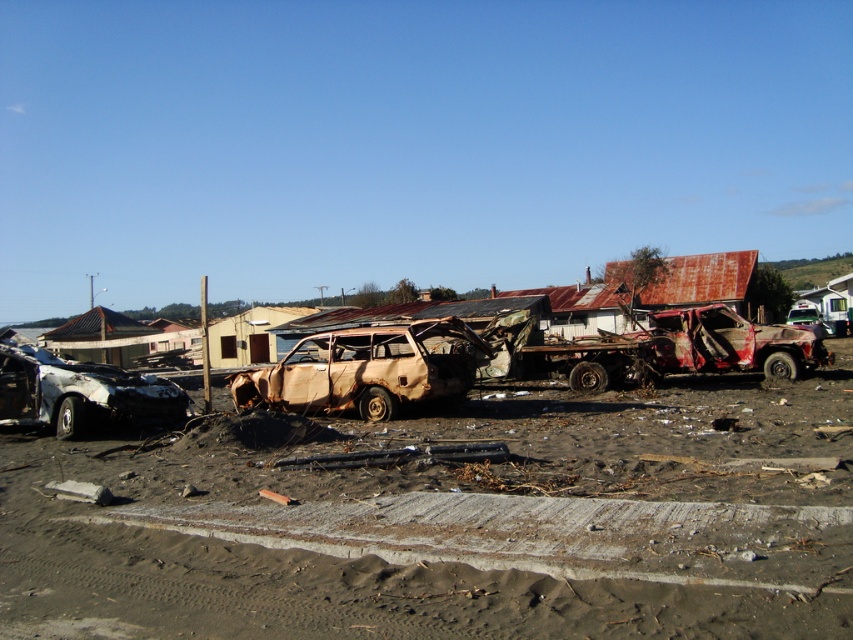
Is burnt wood car at center to the left of burnt wood car at lower left from the viewer's perspective?

No, burnt wood car at center is not to the left of burnt wood car at lower left.

This screenshot has width=853, height=640. What do you see at coordinates (368, 369) in the screenshot?
I see `burnt wood car at center` at bounding box center [368, 369].

Is point (331, 404) less distant than point (140, 381)?

No, (331, 404) is further to viewer.

Find the location of a particular element. This screenshot has width=853, height=640. burnt wood car at center is located at coordinates (368, 369).

Does burnt wood car at lower left appear under rusty metal truck at center-right?

Correct, burnt wood car at lower left is located below rusty metal truck at center-right.

Does point (149, 406) lie in front of point (764, 369)?

Yes, point (149, 406) is in front of point (764, 369).

This screenshot has width=853, height=640. Identify the location of burnt wood car at lower left. (80, 392).

Can you confirm if rusty metal truck at center-right is positioned to the right of rusty metal truck at right?

Incorrect, rusty metal truck at center-right is not on the right side of rusty metal truck at right.

Is point (746, 324) positioned behind point (798, 324)?

No.

This screenshot has height=640, width=853. What are the coordinates of `rusty metal truck at center-right` in the screenshot? It's located at (730, 342).